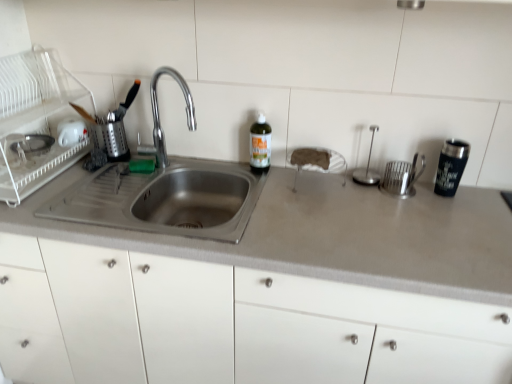
The image size is (512, 384). In order to click on vacant area that is situated to the right of white glossy mug at upper left, the 2th appliance viewed from the left in this screenshot , I will do `click(119, 160)`.